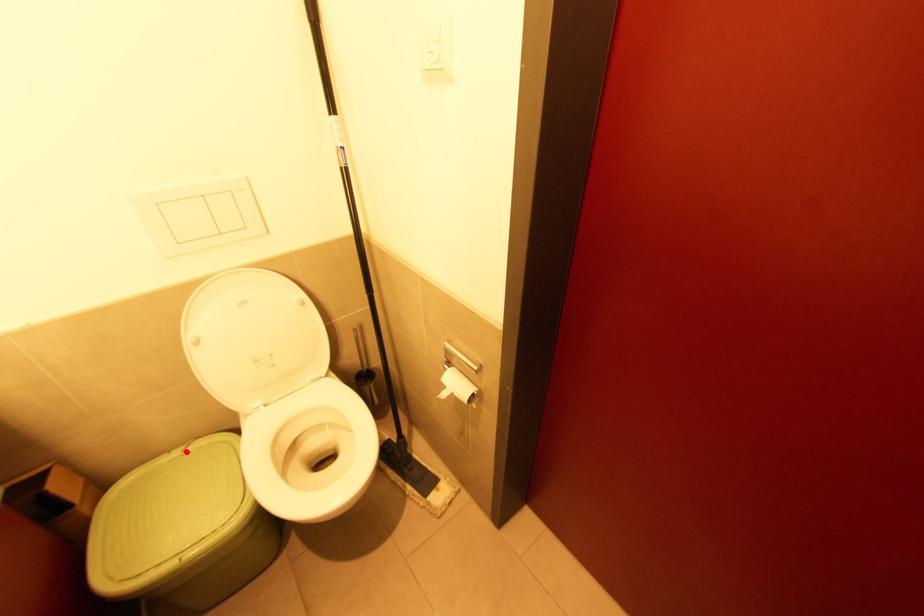
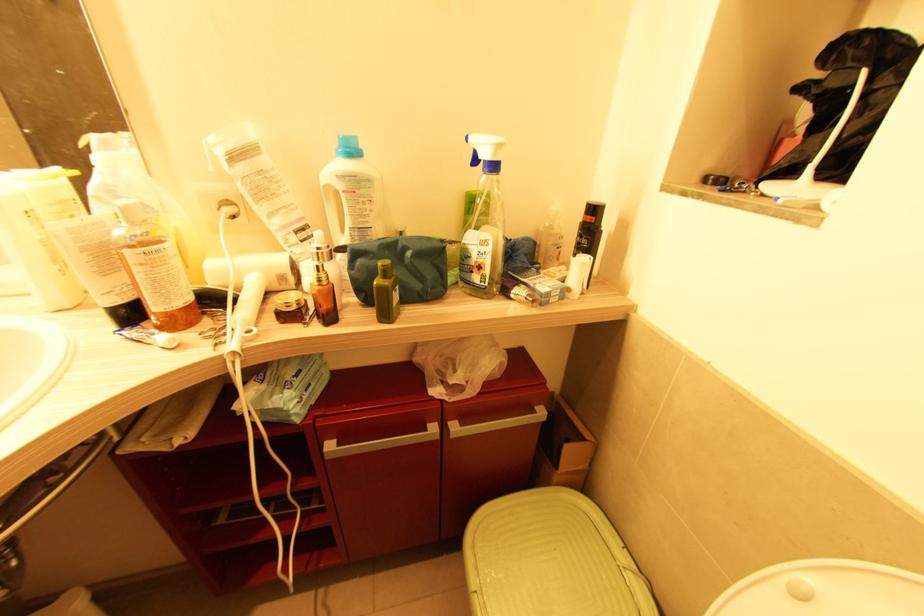
Locate, in the second image, the point that corresponds to the highlighted location in the first image.

(626, 570)